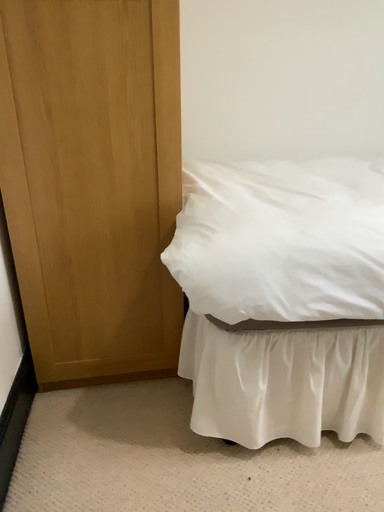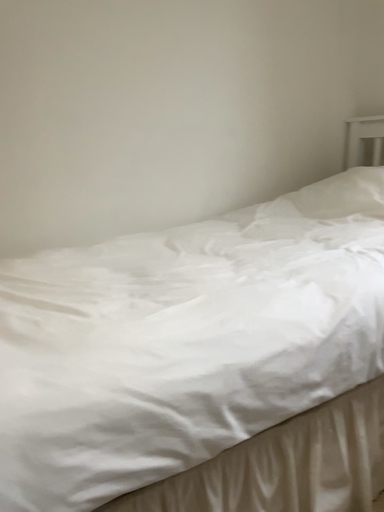
Question: Which way did the camera rotate in the video?

Choices:
 (A) rotated right
 (B) rotated left

Answer: (A)